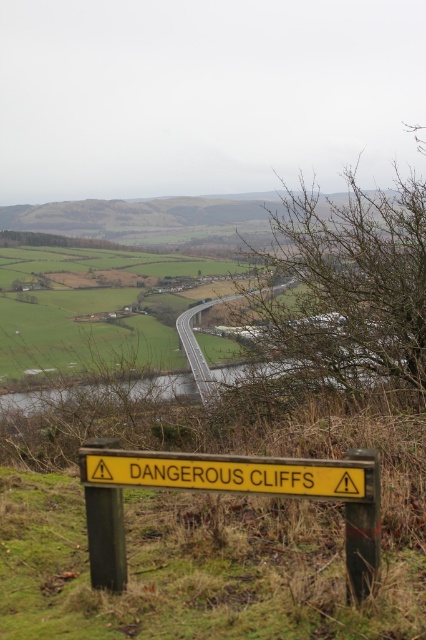
Question: Which object is positioned closest to the brown grassy hillside at upper center?

Choices:
 (A) yellowmaterial/texturewarning sign at lower center
 (B) yellow wooden sign at lower center

Answer: (B)

Question: Observing the image, what is the correct spatial positioning of brown grassy hillside at upper center in reference to yellowmaterial/texturewarning sign at lower center?

Choices:
 (A) left
 (B) right

Answer: (A)

Question: Is yellow wooden sign at lower center above yellowmaterial/texturewarning sign at lower center?

Choices:
 (A) no
 (B) yes

Answer: (A)

Question: Can you confirm if yellow wooden sign at lower center is positioned below brown grassy hillside at upper center?

Choices:
 (A) no
 (B) yes

Answer: (B)

Question: Which point is closer to the camera taking this photo?

Choices:
 (A) (293, 465)
 (B) (236, 221)

Answer: (A)

Question: Among these points, which one is farthest from the camera?

Choices:
 (A) (203, 483)
 (B) (123, 212)
 (C) (100, 448)

Answer: (B)